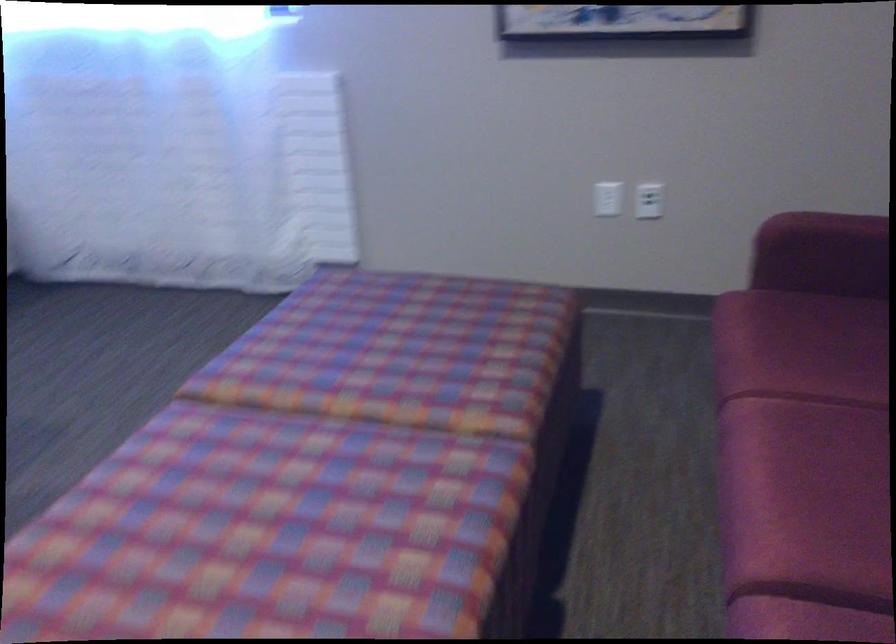
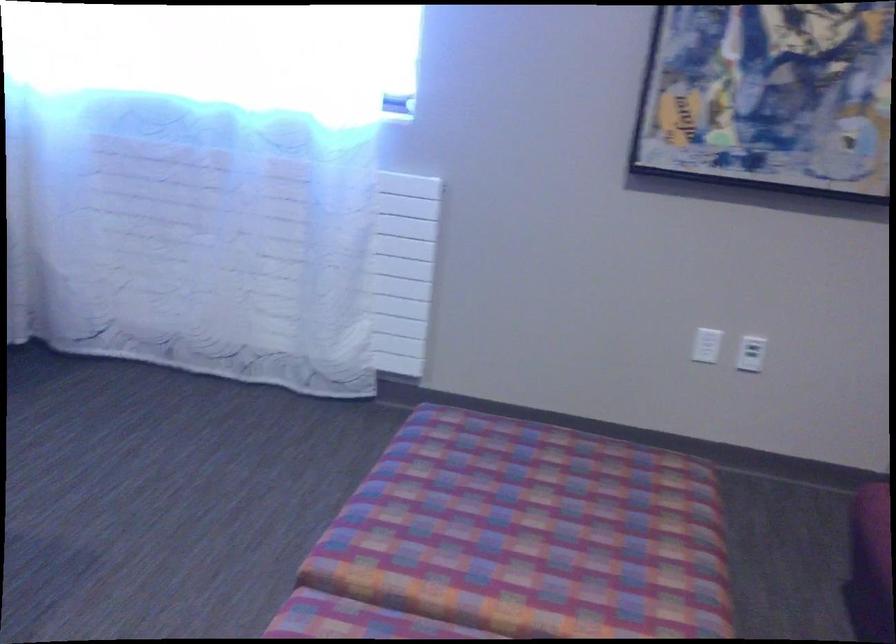
Locate, in the second image, the point that corresponds to [401,335] in the first image.

(550, 516)